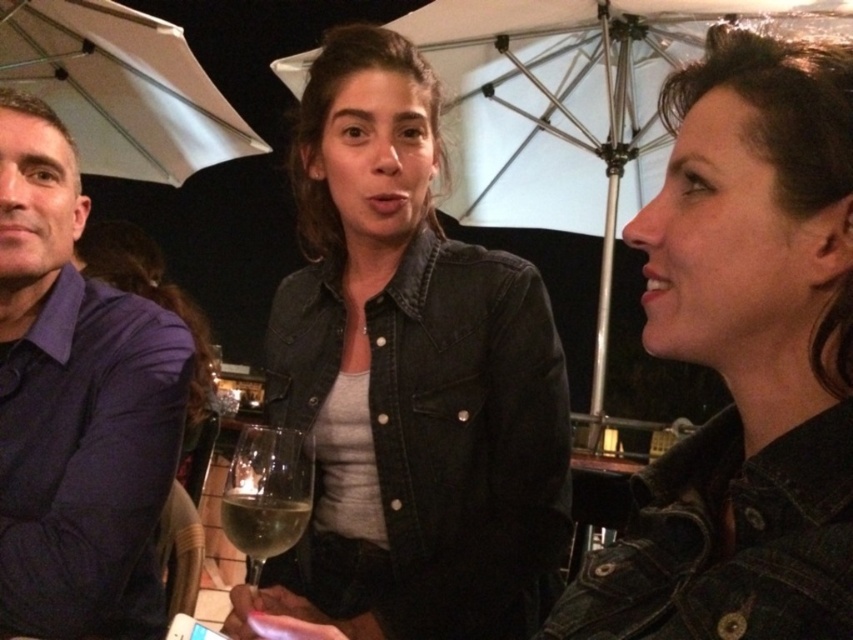
Question: Estimate the real-world distances between objects in this image. Which object is farther from the white matte umbrella at upper left?

Choices:
 (A) clear glass wine glass at center
 (B) purple shirt at left

Answer: (A)

Question: Is purple shirt at left to the left of white fabric umbrella at upper center from the viewer's perspective?

Choices:
 (A) yes
 (B) no

Answer: (A)

Question: Which object is the closest to the denim jacket at center?

Choices:
 (A) clear glass wine at center
 (B) white fabric umbrella at upper center
 (C) white matte umbrella at upper left
 (D) clear glass wine glass at center

Answer: (D)

Question: Does purple shirt at left appear under clear glass wine glass at center?

Choices:
 (A) yes
 (B) no

Answer: (B)

Question: Which object appears closest to the camera in this image?

Choices:
 (A) denim jacket at center
 (B) white matte umbrella at upper left
 (C) denim jacket at upper right
 (D) purple shirt at left

Answer: (C)

Question: Is white matte umbrella at upper left to the left of clear glass wine at center from the viewer's perspective?

Choices:
 (A) no
 (B) yes

Answer: (B)